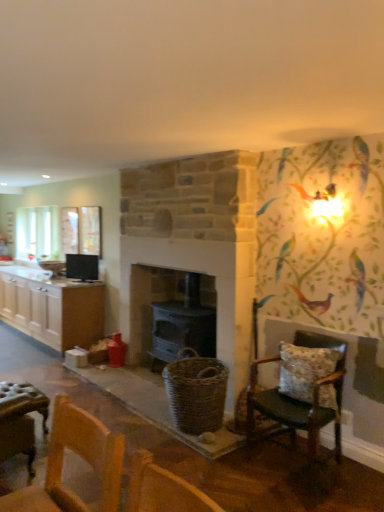
Describe the element at coordinates (304, 369) in the screenshot. The width and height of the screenshot is (384, 512). I see `fluffy fabric pillow at right` at that location.

What do you see at coordinates (82, 266) in the screenshot? This screenshot has height=512, width=384. I see `black glossy monitor at upper left` at bounding box center [82, 266].

What do you see at coordinates (298, 400) in the screenshot? This screenshot has width=384, height=512. I see `floral fabric cushioned chair at right` at bounding box center [298, 400].

Image resolution: width=384 pixels, height=512 pixels. I want to click on matte black stove at center, so click(x=170, y=314).

Is black glossy monitor at upper left not near floral fabric cushioned chair at right?

Yes, black glossy monitor at upper left and floral fabric cushioned chair at right are quite far apart.

Based on the photo, does black glossy monitor at upper left turn towards floral fabric cushioned chair at right?

No, black glossy monitor at upper left is not aimed at floral fabric cushioned chair at right.

From the image's perspective, which is above, black glossy monitor at upper left or floral fabric cushioned chair at right?

From the image's view, black glossy monitor at upper left is above.

In the scene shown: Measure the distance from fluffy fabric pillow at right to floral fabric cushioned chair at right.

A distance of 12.74 centimeters exists between fluffy fabric pillow at right and floral fabric cushioned chair at right.

Who is bigger, fluffy fabric pillow at right or floral fabric cushioned chair at right?

floral fabric cushioned chair at right.

From the image's perspective, is fluffy fabric pillow at right over floral fabric cushioned chair at right?

Yes, from the image's perspective, fluffy fabric pillow at right is over floral fabric cushioned chair at right.

In the scene shown: From a real-world perspective, who is located lower, fluffy fabric pillow at right or floral fabric cushioned chair at right?

In real-world perspective, floral fabric cushioned chair at right is lower.

The height and width of the screenshot is (512, 384). What are the coordinates of `appliance on the left side of floral fabric cushioned chair at right` in the screenshot? It's located at (82, 266).

Can you confirm if floral fabric cushioned chair at right is bigger than black glossy monitor at upper left?

Yes, floral fabric cushioned chair at right is bigger than black glossy monitor at upper left.

From the image's perspective, is floral fabric cushioned chair at right above or below black glossy monitor at upper left?

Clearly, from the image's perspective, floral fabric cushioned chair at right is below black glossy monitor at upper left.

Is black glossy monitor at upper left inside floral fabric cushioned chair at right?

Definitely not — black glossy monitor at upper left is not inside floral fabric cushioned chair at right.

Consider the image. Would you consider floral fabric cushioned chair at right to be distant from white wood cabinets at left?

Yes, floral fabric cushioned chair at right and white wood cabinets at left are located far from each other.

How many degrees apart are the facing directions of floral fabric cushioned chair at right and white wood cabinets at left?

0.858 degrees separate the facing orientations of floral fabric cushioned chair at right and white wood cabinets at left.

From the image's perspective, is floral fabric cushioned chair at right on top of white wood cabinets at left?

Actually, floral fabric cushioned chair at right appears below white wood cabinets at left in the image.

From a real-world perspective, which object rests below the other?

white wood cabinets at left.

From the picture: Considering the sizes of white wood cabinets at left and black glossy monitor at upper left in the image, is white wood cabinets at left wider or thinner than black glossy monitor at upper left?

Clearly, white wood cabinets at left has more width compared to black glossy monitor at upper left.

From a real-world perspective, is white wood cabinets at left positioned above or below black glossy monitor at upper left?

white wood cabinets at left is below black glossy monitor at upper left.

Between white wood cabinets at left and black glossy monitor at upper left, which one has less height?

With less height is black glossy monitor at upper left.

From a real-world perspective, who is located lower, matte black stove at center or fluffy fabric pillow at right?

fluffy fabric pillow at right, from a real-world perspective.

Which is more to the left, matte black stove at center or fluffy fabric pillow at right?

matte black stove at center.

Is matte black stove at center positioned with its back to fluffy fabric pillow at right?

That's not correct — matte black stove at center is not looking away from fluffy fabric pillow at right.

From the picture: Which object is closer to the camera, matte black stove at center or floral fabric cushioned chair at right?

Positioned in front is floral fabric cushioned chair at right.

At what (x,y) coordinates should I click in order to perform the action: click on chair on the right of matte black stove at center. Please return your answer as a coordinate pair (x, y). Image resolution: width=384 pixels, height=512 pixels. Looking at the image, I should click on (298, 400).

Can you see matte black stove at center touching floral fabric cushioned chair at right?

There is a gap between matte black stove at center and floral fabric cushioned chair at right.

The height and width of the screenshot is (512, 384). What are the coordinates of `appliance that appears behind the floral fabric cushioned chair at right` in the screenshot? It's located at (82, 266).

At what (x,y) coordinates should I click in order to perform the action: click on chair below the fluffy fabric pillow at right (from a real-world perspective). Please return your answer as a coordinate pair (x, y). The width and height of the screenshot is (384, 512). Looking at the image, I should click on (298, 400).

Based on their spatial positions, is white wood cabinets at left or matte black stove at center further from fluffy fabric pillow at right?

The object further to fluffy fabric pillow at right is white wood cabinets at left.

Looking at the image, which one is located closer to matte black stove at center, floral fabric cushioned chair at right or white wood cabinets at left?

floral fabric cushioned chair at right.

Based on their spatial positions, is black glossy monitor at upper left or white wood cabinets at left further from fluffy fabric pillow at right?

Among the two, white wood cabinets at left is located further to fluffy fabric pillow at right.

From the image, which object appears to be farther from white wood cabinets at left, black glossy monitor at upper left or matte black stove at center?

matte black stove at center.

Estimate the real-world distances between objects in this image. Which object is further from fluffy fabric pillow at right, floral fabric cushioned chair at right or white wood cabinets at left?

Based on the image, white wood cabinets at left appears to be further to fluffy fabric pillow at right.

Looking at the image, which one is located closer to black glossy monitor at upper left, white wood cabinets at left or floral fabric cushioned chair at right?

Among the two, white wood cabinets at left is located nearer to black glossy monitor at upper left.

Which object lies further to the anchor point black glossy monitor at upper left, floral fabric cushioned chair at right or fluffy fabric pillow at right?

fluffy fabric pillow at right is further to black glossy monitor at upper left.

Estimate the real-world distances between objects in this image. Which object is closer to matte black stove at center, white wood cabinets at left or black glossy monitor at upper left?

black glossy monitor at upper left lies closer to matte black stove at center than the other object.

Identify the location of fireplace between white wood cabinets at left and fluffy fabric pillow at right. The height and width of the screenshot is (512, 384). (170, 314).

What are the coordinates of `fireplace between floral fabric cushioned chair at right and black glossy monitor at upper left from front to back` in the screenshot? It's located at (170, 314).

The height and width of the screenshot is (512, 384). I want to click on appliance situated between white wood cabinets at left and fluffy fabric pillow at right from left to right, so click(x=82, y=266).

Find the location of a particular element. pillow between floral fabric cushioned chair at right and black glossy monitor at upper left from front to back is located at coordinates (304, 369).